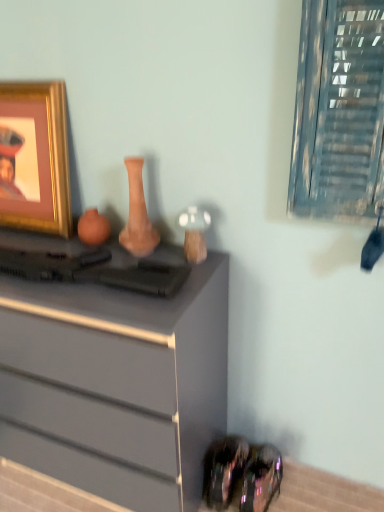
Question: Is gold metallic picture frame at upper left facing away from matte clay vase at center?

Choices:
 (A) no
 (B) yes

Answer: (A)

Question: Would you say gold metallic picture frame at upper left contains matte clay vase at center?

Choices:
 (A) yes
 (B) no

Answer: (B)

Question: Is gold metallic picture frame at upper left closer to camera compared to matte clay vase at center?

Choices:
 (A) no
 (B) yes

Answer: (A)

Question: Is gold metallic picture frame at upper left at the right side of matte clay vase at center?

Choices:
 (A) yes
 (B) no

Answer: (B)

Question: From the image's perspective, is gold metallic picture frame at upper left located beneath matte clay vase at center?

Choices:
 (A) no
 (B) yes

Answer: (A)

Question: Is gold metallic picture frame at upper left shorter than matte clay vase at center?

Choices:
 (A) no
 (B) yes

Answer: (A)

Question: Considering the relative positions of metallic glass window at upper right and shiny black shoe at lower right in the image provided, is metallic glass window at upper right to the left of shiny black shoe at lower right from the viewer's perspective?

Choices:
 (A) yes
 (B) no

Answer: (B)

Question: Is metallic glass window at upper right facing towards shiny black shoe at lower right?

Choices:
 (A) no
 (B) yes

Answer: (A)

Question: Is metallic glass window at upper right positioned with its back to shiny black shoe at lower right?

Choices:
 (A) yes
 (B) no

Answer: (B)

Question: Is metallic glass window at upper right thinner than shiny black shoe at lower right?

Choices:
 (A) yes
 (B) no

Answer: (A)

Question: Is shiny black shoe at lower right located within metallic glass window at upper right?

Choices:
 (A) no
 (B) yes

Answer: (A)

Question: Is metallic glass window at upper right shorter than shiny black shoe at lower right?

Choices:
 (A) yes
 (B) no

Answer: (B)

Question: Is the depth of metallic glass window at upper right greater than that of matte gray chest of drawers at center?

Choices:
 (A) yes
 (B) no

Answer: (B)